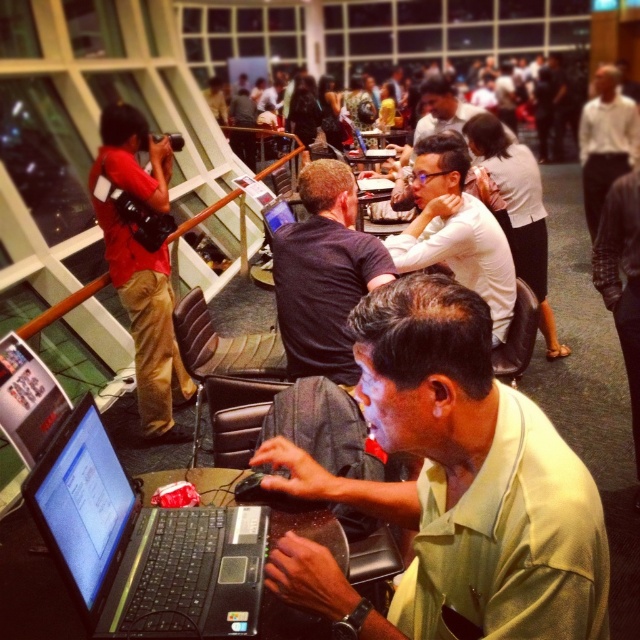
Question: Which point appears farthest from the camera in this image?

Choices:
 (A) (333, 218)
 (B) (12, 371)
 (C) (369, 140)
 (D) (609, 188)

Answer: (C)

Question: Estimate the real-world distances between objects in this image. Which object is closer to the matte black laptop at center?

Choices:
 (A) light green shirt at center
 (B) red shirt at left
 (C) white matte shirt at center

Answer: (B)

Question: Is light green shirt at center above white shirt at upper right?

Choices:
 (A) yes
 (B) no

Answer: (B)

Question: Does red shirt at left have a larger size compared to white shirt at upper right?

Choices:
 (A) no
 (B) yes

Answer: (A)

Question: Which point is closer to the camera?

Choices:
 (A) dark brown shirt at center
 (B) black glossy laptop at lower left
 (C) light green shirt at center
 (D) matte black laptop at center

Answer: (C)

Question: Can you confirm if light green shirt at center is positioned above matte black laptop at center?

Choices:
 (A) yes
 (B) no

Answer: (B)